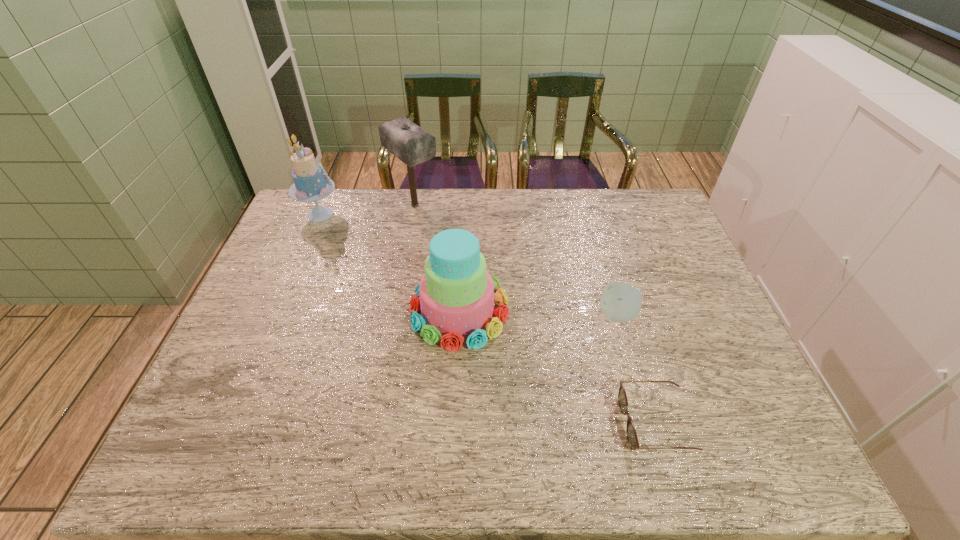
This screenshot has height=540, width=960. I want to click on vacant space that's between the shorter cake and the second shortest object, so click(539, 313).

You are a GUI agent. You are given a task and a screenshot of the screen. Output one action in this format:
    pyautogui.click(x=<x>, y=<y>)
    Task: Click on the vacant region between the nearest object and the shorter cake
    Image resolution: width=960 pixels, height=540 pixels.
    Given the screenshot: What is the action you would take?
    pyautogui.click(x=557, y=367)

Locate an element on the screen. free space between the nearer cake and the leftmost object is located at coordinates coord(390,262).

This screenshot has width=960, height=540. I want to click on free space between the right cake and the shortest object, so click(x=557, y=367).

This screenshot has height=540, width=960. I want to click on object that stands as the fourth closest to the fourth tallest object, so click(310, 184).

Identify the location of object that is the second closest to the nearest object. click(456, 294).

The height and width of the screenshot is (540, 960). What are the coordinates of `free point that satisfies the following two spatial constraints: 1. with a ladder on the side of the left cake; 2. on the back side of the fourth tallest object` in the screenshot? It's located at (277, 315).